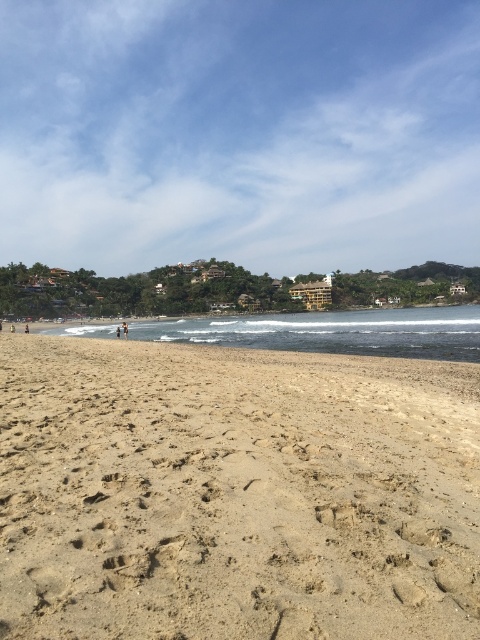
Who is taller, light brown sandy beach at lower left or brown sand at lower left?

Standing taller between the two is light brown sandy beach at lower left.

Does light brown sandy beach at lower left have a larger size compared to brown sand at lower left?

Yes.

Image resolution: width=480 pixels, height=640 pixels. Find the location of `light brown sandy beach at lower left`. light brown sandy beach at lower left is located at coordinates (235, 493).

The width and height of the screenshot is (480, 640). I want to click on light brown sandy beach at lower left, so click(235, 493).

Does clear blue water at center have a lesser width compared to brown sand at lower left?

No, clear blue water at center is not thinner than brown sand at lower left.

Measure the distance between clear blue water at center and brown sand at lower left.

clear blue water at center is 77.67 meters from brown sand at lower left.

Does point (453, 317) come farther from viewer compared to point (12, 332)?

Yes, it is.

Identify the location of clear blue water at center. (335, 332).

Is the position of tan skin person at center less distant than that of brown sand at lower left?

Yes, it is.

Can you confirm if tan skin person at center is positioned below brown sand at lower left?

Incorrect, tan skin person at center is not positioned below brown sand at lower left.

Which is behind, point (121, 324) or point (10, 330)?

Point (121, 324)

Identify the location of tan skin person at center. (124, 330).